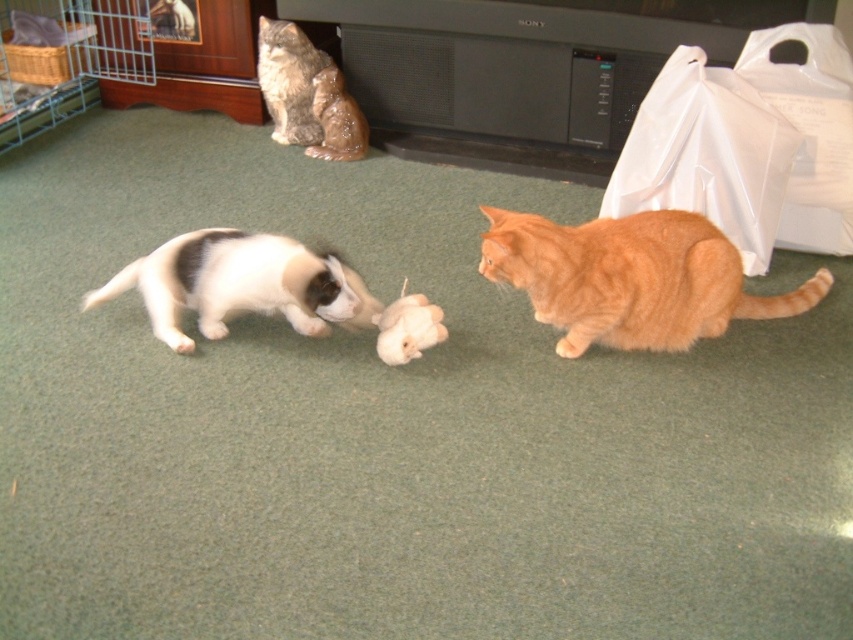
Between white plastic bag at upper right and white fur at center, which one appears on the right side from the viewer's perspective?

white plastic bag at upper right

Is white plastic bag at upper right positioned before white fur at center?

That is False.

What do you see at coordinates (706, 154) in the screenshot? Image resolution: width=853 pixels, height=640 pixels. I see `white plastic bag at upper right` at bounding box center [706, 154].

You are a GUI agent. You are given a task and a screenshot of the screen. Output one action in this format:
    pyautogui.click(x=<x>, y=<y>)
    Task: Click on the white plastic bag at upper right
    The image size is (853, 640).
    Given the screenshot: What is the action you would take?
    pyautogui.click(x=706, y=154)

Can you confirm if gray tabby cat at upper left is bigger than white plush mouse at center?

Yes, gray tabby cat at upper left is bigger than white plush mouse at center.

Between gray tabby cat at upper left and white plush mouse at center, which one is positioned lower?

white plush mouse at center

Locate an element on the screen. gray tabby cat at upper left is located at coordinates (289, 81).

Can you confirm if white plastic bag at upper right is bigger than gray tabby cat at upper left?

Correct, white plastic bag at upper right is larger in size than gray tabby cat at upper left.

Which is in front, point (772, 166) or point (271, 48)?

Point (772, 166)

The width and height of the screenshot is (853, 640). What do you see at coordinates (706, 154) in the screenshot? I see `white plastic bag at upper right` at bounding box center [706, 154].

You are a GUI agent. You are given a task and a screenshot of the screen. Output one action in this format:
    pyautogui.click(x=<x>, y=<y>)
    Task: Click on the white plastic bag at upper right
    
    Given the screenshot: What is the action you would take?
    pyautogui.click(x=706, y=154)